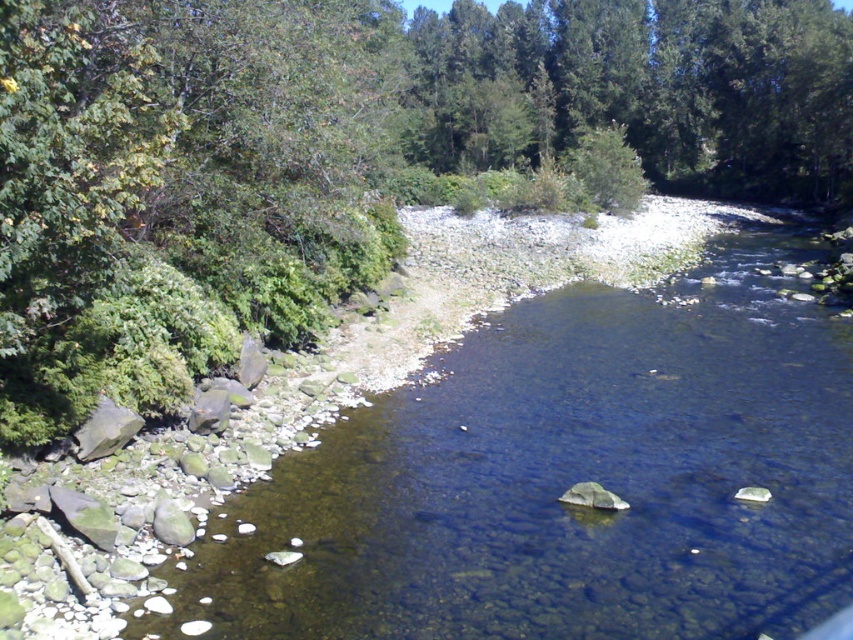
Image resolution: width=853 pixels, height=640 pixels. What do you see at coordinates (351, 157) in the screenshot? I see `green leafy tree at upper left` at bounding box center [351, 157].

Is point (666, 74) positioned after point (750, 10)?

Yes.

Which is behind, point (222, 268) or point (433, 83)?

The point (433, 83) is behind.

Identify the location of green leafy tree at upper left. [x=351, y=157].

Measure the distance between clear water at river center and camera.

The distance of clear water at river center from camera is 23.63 feet.

Who is more forward, (490,387) or (796,93)?

Point (490,387)

Identify the location of clear water at river center. This screenshot has width=853, height=640. (566, 480).

Can you confirm if green leafy tree at upper left is positioned to the left of clear water at river center?

Incorrect, green leafy tree at upper left is not on the left side of clear water at river center.

Who is more distant from viewer, (82, 369) or (282, 630)?

The point (82, 369) is more distant.

What do you see at coordinates (351, 157) in the screenshot? I see `green leafy tree at upper left` at bounding box center [351, 157].

Find the location of `green leafy tree at upper left`. green leafy tree at upper left is located at coordinates (351, 157).